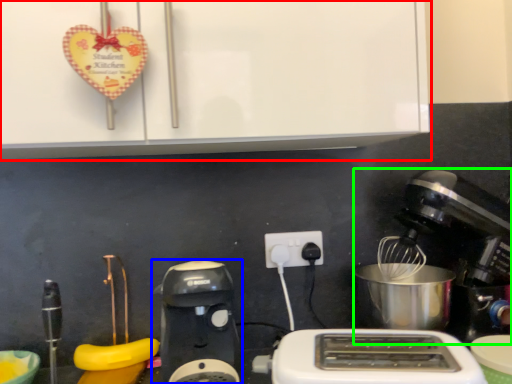
Question: Which is nearer to the cabinetry (highlighted by a red box)? coffee maker (highlighted by a blue box) or mixer (highlighted by a green box).

Choices:
 (A) coffee maker
 (B) mixer

Answer: (A)